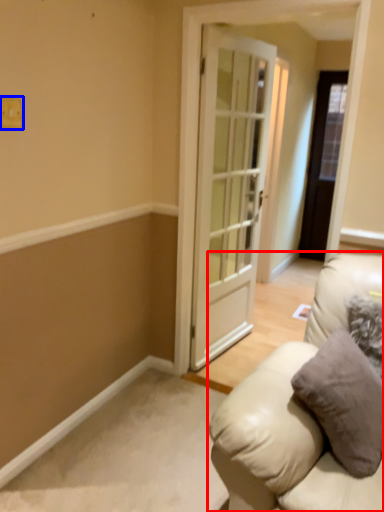
Question: Which point is closer to the camera, studio couch (highlighted by a red box) or light switch (highlighted by a blue box)?

Choices:
 (A) studio couch
 (B) light switch

Answer: (A)